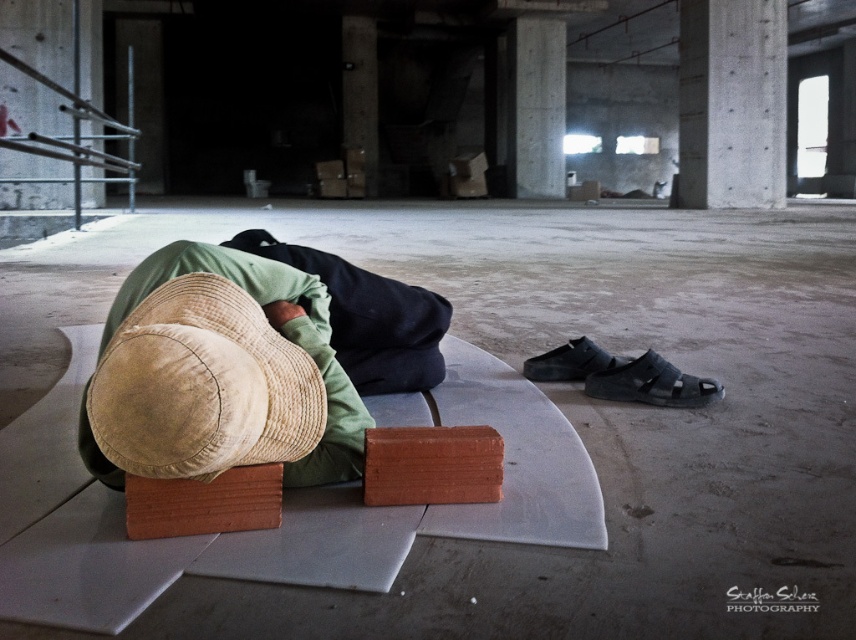
Who is lower down, orange brick at center or concrete/cement pillar at upper center?

orange brick at center

Between point (382, 259) and point (520, 48), which one is positioned in front?

Point (382, 259) is in front.

Is point (736, 552) farther from camera compared to point (548, 81)?

That is False.

You are a GUI agent. You are given a task and a screenshot of the screen. Output one action in this format:
    pyautogui.click(x=<x>, y=<y>)
    Task: Click on the orange brick at center
    The height and width of the screenshot is (640, 856).
    Given the screenshot: What is the action you would take?
    pyautogui.click(x=560, y=406)

Is orange brick at center shorter than concrete at upper right?

Correct, orange brick at center is not as tall as concrete at upper right.

In the scene shown: Between orange brick at center and concrete at upper right, which one is positioned lower?

Positioned lower is orange brick at center.

Does point (221, 236) lie in front of point (777, 198)?

Yes.

Where is `orange brick at center`? orange brick at center is located at coordinates (560, 406).

Does tan straw hat at center have a smaller size compared to concrete at upper right?

Correct, tan straw hat at center occupies less space than concrete at upper right.

Consider the image. Who is positioned more to the right, tan straw hat at center or concrete at upper right?

concrete at upper right

Image resolution: width=856 pixels, height=640 pixels. What do you see at coordinates (201, 385) in the screenshot? I see `tan straw hat at center` at bounding box center [201, 385].

I want to click on tan straw hat at center, so click(x=201, y=385).